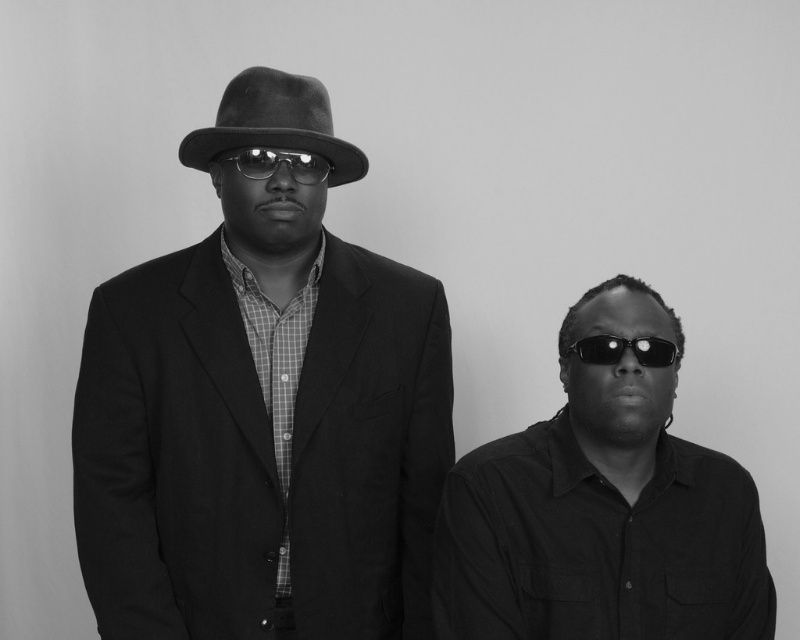
Does point (254, 616) lie behind point (584, 349)?

Yes, point (254, 616) is behind point (584, 349).

From the picture: Who is more distant from viewer, (380, 314) or (598, 362)?

Positioned behind is point (380, 314).

Which is in front, point (226, 385) or point (600, 349)?

Point (600, 349) is in front.

You are a GUI agent. You are given a task and a screenshot of the screen. Output one action in this format:
    pyautogui.click(x=<x>, y=<y>)
    Task: Click on the matte black hat at center
    This screenshot has width=800, height=640.
    Given the screenshot: What is the action you would take?
    pyautogui.click(x=264, y=410)

Consider the image. Is matte black shirt at right bigger than felt fedora at center?

Indeed, matte black shirt at right has a larger size compared to felt fedora at center.

Is matte black shirt at right behind felt fedora at center?

No, matte black shirt at right is closer to the viewer.

Is point (645, 470) positioned in front of point (188, 132)?

That is True.

The width and height of the screenshot is (800, 640). Find the location of `matte black shirt at right`. matte black shirt at right is located at coordinates (601, 525).

Is felt fedora at center positioned in front of black reflective sunglasses at right?

Yes.

Is point (318, 140) closer to camera compared to point (608, 348)?

That is False.

This screenshot has height=640, width=800. In order to click on felt fedora at center in this screenshot , I will do `click(274, 124)`.